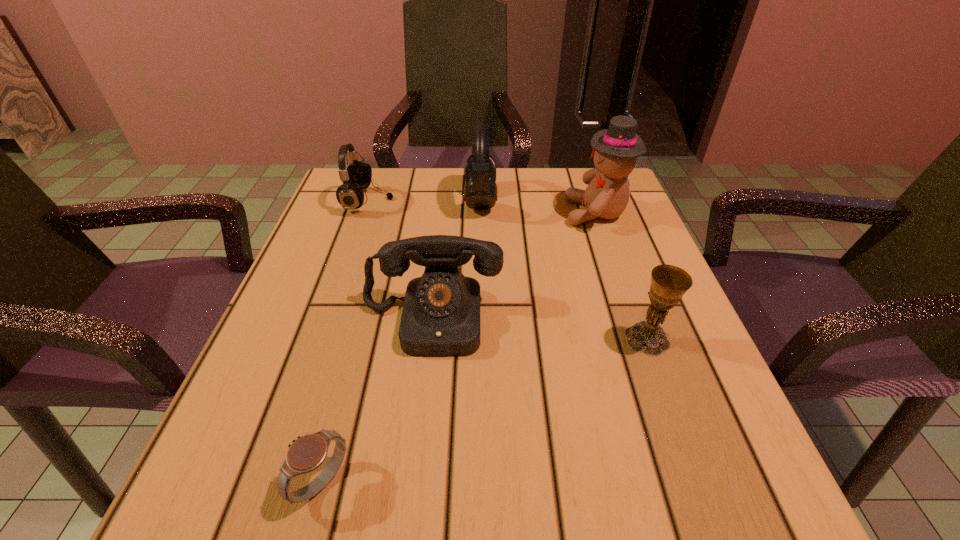
Where is `rag_doll`? Image resolution: width=960 pixels, height=540 pixels. rag_doll is located at coordinates (615, 150).

Identify the location of the taller headset. The width and height of the screenshot is (960, 540). (480, 190).

At what (x,y) coordinates should I click in order to perform the action: click on the fifth shortest object. Please return your answer as a coordinate pair (x, y). The width and height of the screenshot is (960, 540). Looking at the image, I should click on (480, 190).

Locate an element on the screen. The image size is (960, 540). telephone is located at coordinates (441, 313).

Find the location of a particular element. the shorter headset is located at coordinates (358, 175).

Locate an element on the screen. The height and width of the screenshot is (540, 960). chalice is located at coordinates (669, 283).

You are a GUI agent. You are given a task and a screenshot of the screen. Output one action in this format:
    pyautogui.click(x=<x>, y=<y>)
    Task: Click on the watch
    The width and height of the screenshot is (960, 540).
    Given the screenshot: What is the action you would take?
    pyautogui.click(x=307, y=453)

Find the location of a particular element. The image size is (960, 540). the nearest object is located at coordinates (307, 453).

I want to click on free space located on the front-facing side of the rag_doll, so click(x=543, y=213).

Image resolution: width=960 pixels, height=540 pixels. What are the coordinates of `vacant region located 0.180m on the front-facing side of the rag_doll` in the screenshot? It's located at click(x=488, y=213).